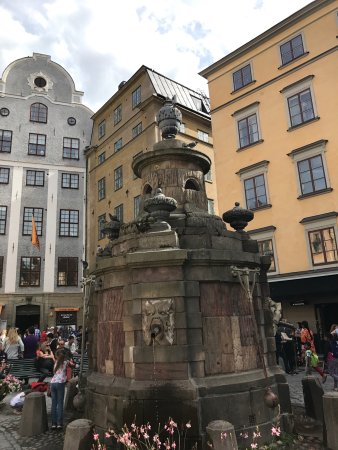
This screenshot has height=450, width=338. Find the location of `windows`. windows is located at coordinates (75, 233), (39, 233).